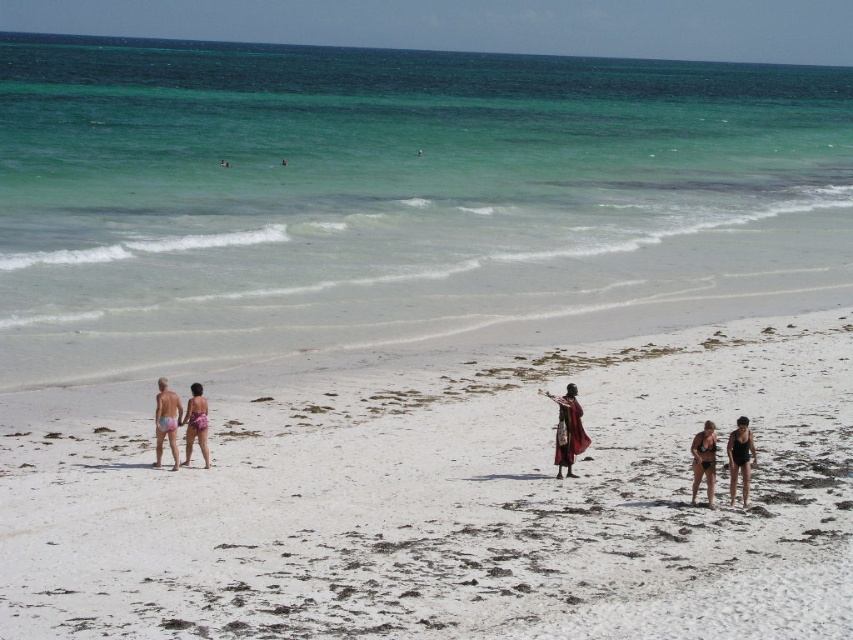
You are a photographer trying to capture a photo of the beach scene. You want to ensure both the red fabric person at center and the pink fabric shorts at left are clearly visible in your shot. Based on their sizes, which one might you need to adjust your camera focus for more carefully?

The red fabric person at center is bigger than the pink fabric shorts at left, so you might need to adjust your camera focus more carefully for the pink fabric shorts at left to ensure they are clearly visible.

You are a photographer trying to capture the scene. You notice the point at coordinate [703,460]. What object is located at that point?

The point at coordinate [703,460] is on the matte black bikini at lower right.